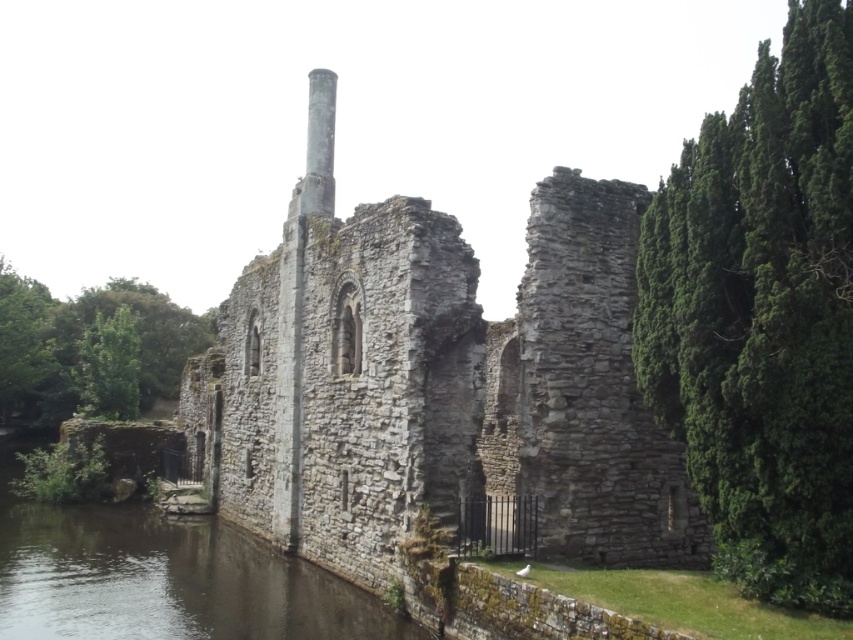
Question: Which of the following is the farthest from the observer?

Choices:
 (A) (77, 612)
 (B) (454, 220)

Answer: (B)

Question: Which object appears closest to the camera in this image?

Choices:
 (A) dark gray stone river at lower left
 (B) stone wall at center

Answer: (A)

Question: Is stone wall at center in front of dark gray stone river at lower left?

Choices:
 (A) yes
 (B) no

Answer: (B)

Question: Does stone wall at center have a larger size compared to dark gray stone river at lower left?

Choices:
 (A) no
 (B) yes

Answer: (B)

Question: Which object is farther from the camera taking this photo?

Choices:
 (A) dark gray stone river at lower left
 (B) stone wall at center

Answer: (B)

Question: Is stone wall at center positioned behind dark gray stone river at lower left?

Choices:
 (A) yes
 (B) no

Answer: (A)